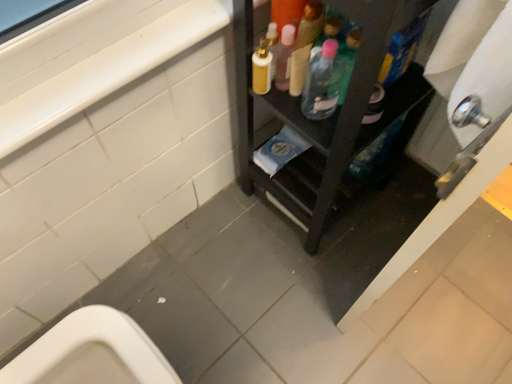
Question: Does translucent plastic bottle at center, positioned as the first bottle in left-to-right order, appear on the right side of translucent plastic bottle at upper center, positioned as the 2th bottle in left-to-right order?

Choices:
 (A) yes
 (B) no

Answer: (B)

Question: From a real-world perspective, is translucent plastic bottle at center, marked as the 2th bottle in a right-to-left arrangement, beneath translucent plastic bottle at upper center, positioned as the 2th bottle in left-to-right order?

Choices:
 (A) yes
 (B) no

Answer: (A)

Question: From a real-world perspective, is translucent plastic bottle at center, marked as the 2th bottle in a right-to-left arrangement, physically above translucent plastic bottle at upper center, positioned as the 2th bottle in left-to-right order?

Choices:
 (A) yes
 (B) no

Answer: (B)

Question: From the image's perspective, is translucent plastic bottle at center, marked as the 2th bottle in a right-to-left arrangement, beneath translucent plastic bottle at upper center, the first bottle from the right?

Choices:
 (A) no
 (B) yes

Answer: (A)

Question: Would you say translucent plastic bottle at upper center, the first bottle from the right, is part of translucent plastic bottle at center, marked as the 2th bottle in a right-to-left arrangement,'s contents?

Choices:
 (A) yes
 (B) no

Answer: (B)

Question: In terms of size, does translucent plastic bottle at upper center, positioned as the 2th bottle in left-to-right order, appear bigger or smaller than translucent plastic bottle at center, positioned as the first bottle in left-to-right order?

Choices:
 (A) big
 (B) small

Answer: (A)

Question: In the image, is translucent plastic bottle at upper center, the first bottle from the right, on the left side or the right side of translucent plastic bottle at center, marked as the 2th bottle in a right-to-left arrangement?

Choices:
 (A) right
 (B) left

Answer: (A)

Question: From the image's perspective, relative to translucent plastic bottle at center, marked as the 2th bottle in a right-to-left arrangement, is translucent plastic bottle at upper center, the first bottle from the right, above or below?

Choices:
 (A) below
 (B) above

Answer: (A)

Question: Is translucent plastic bottle at upper center, positioned as the 2th bottle in left-to-right order, in front of or behind translucent plastic bottle at center, positioned as the first bottle in left-to-right order, in the image?

Choices:
 (A) front
 (B) behind

Answer: (A)

Question: From the image's perspective, is translucent plastic bottle at center, positioned as the first bottle in left-to-right order, located above or below black wood shelf at center?

Choices:
 (A) below
 (B) above

Answer: (B)

Question: Is translucent plastic bottle at center, positioned as the first bottle in left-to-right order, situated inside black wood shelf at center or outside?

Choices:
 (A) inside
 (B) outside

Answer: (A)

Question: Does point (317, 74) appear closer or farther from the camera than point (242, 148)?

Choices:
 (A) closer
 (B) farther

Answer: (A)

Question: From a real-world perspective, is translucent plastic bottle at center, marked as the 2th bottle in a right-to-left arrangement, positioned above or below black wood shelf at center?

Choices:
 (A) above
 (B) below

Answer: (A)

Question: Is point (411, 62) positioned closer to the camera than point (340, 46)?

Choices:
 (A) farther
 (B) closer

Answer: (A)

Question: From the image's perspective, is black wood shelf at center located above or below translucent plastic bottle at upper center, positioned as the 2th bottle in left-to-right order?

Choices:
 (A) above
 (B) below

Answer: (B)